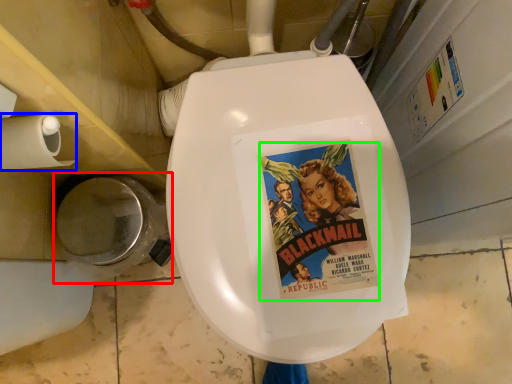
Question: Which object is positioned farthest from toilet bowl (highlighted by a red box)? Select from toilet paper (highlighted by a blue box) and comic book character (highlighted by a green box).

Choices:
 (A) toilet paper
 (B) comic book character

Answer: (B)